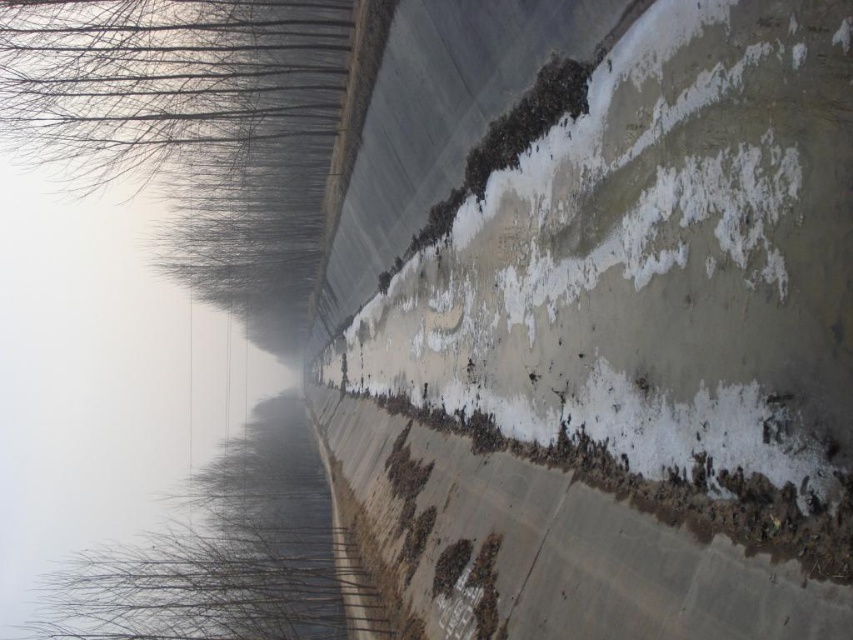
You are a delivery drone that needs to fly from the road to the transparent water at upper left. The white rough concrete at center is in your path. Can you pass through the space between them without needing to hover?

The white rough concrete at center is narrower than the transparent water at upper left, so the drone can pass through the space between them without needing to hover.

You are a construction worker assessing the site. You see the white rough concrete at center and the transparent water at upper left. Which object is lower in height?

The white rough concrete at center has a lesser height compared to the transparent water at upper left, so the white rough concrete at center is lower in height.

You are a delivery drone flying above the road and need to land on the white rough concrete at center. However, you notice transparent water at upper left nearby. Which object should you avoid landing on and why?

You should avoid landing on the transparent water at upper left because the white rough concrete at center is in front of it, meaning the water is likely further away or not a solid surface for landing.